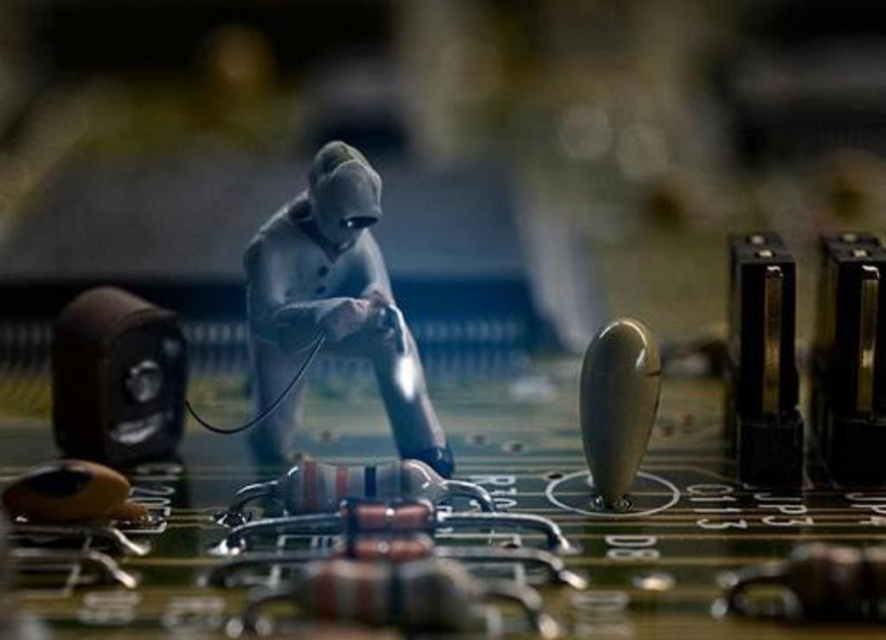
Question: Does silver metallic figure at center have a larger size compared to matte gray knob at center-right?

Choices:
 (A) no
 (B) yes

Answer: (B)

Question: Where is silver metallic figure at center located in relation to matte gray knob at center-right in the image?

Choices:
 (A) left
 (B) right

Answer: (A)

Question: Among these points, which one is farthest from the camera?

Choices:
 (A) (290, 314)
 (B) (615, 380)

Answer: (A)

Question: Can you confirm if silver metallic figure at center is thinner than matte gray knob at center-right?

Choices:
 (A) yes
 (B) no

Answer: (B)

Question: Which object is closer to the camera taking this photo?

Choices:
 (A) silver metallic figure at center
 (B) matte gray knob at center-right

Answer: (B)